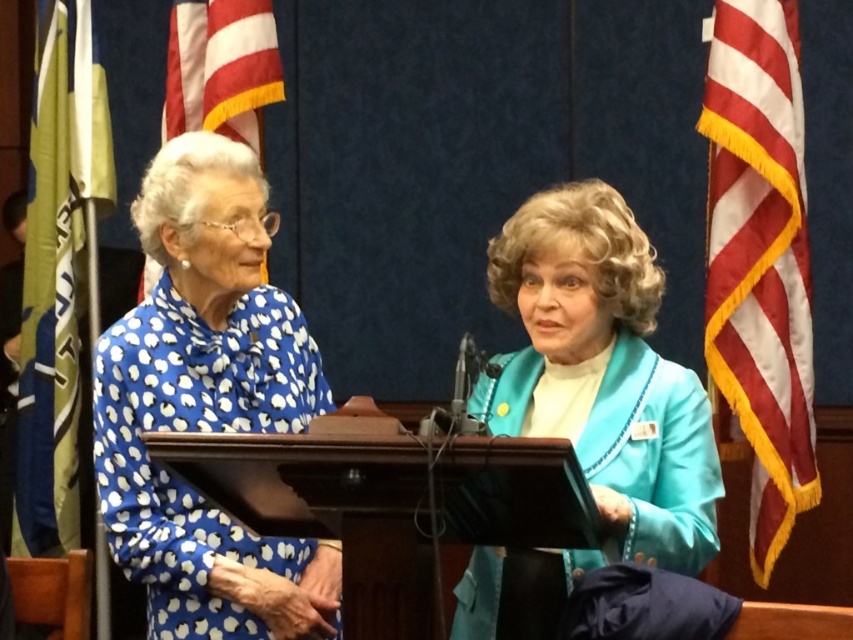
Does point (299, 602) lie behind point (44, 416)?

No, (299, 602) is closer to viewer.

Which of these two, blue dotted blouse at left or yellow fabric flag at left, stands taller?

yellow fabric flag at left

Which is in front, point (136, 451) or point (88, 54)?

Point (136, 451) is in front.

Where is `blue dotted blouse at left`? Image resolution: width=853 pixels, height=640 pixels. blue dotted blouse at left is located at coordinates (207, 403).

Is teal satin blazer at center smaller than american flag at upper left?

No, teal satin blazer at center is not smaller than american flag at upper left.

Which is below, teal satin blazer at center or american flag at upper left?

teal satin blazer at center

Where is `teal satin blazer at center`? The height and width of the screenshot is (640, 853). teal satin blazer at center is located at coordinates (589, 404).

Is blue dotted blouse at left positioned behind teal satin blazer at center?

Yes.

I want to click on blue dotted blouse at left, so click(207, 403).